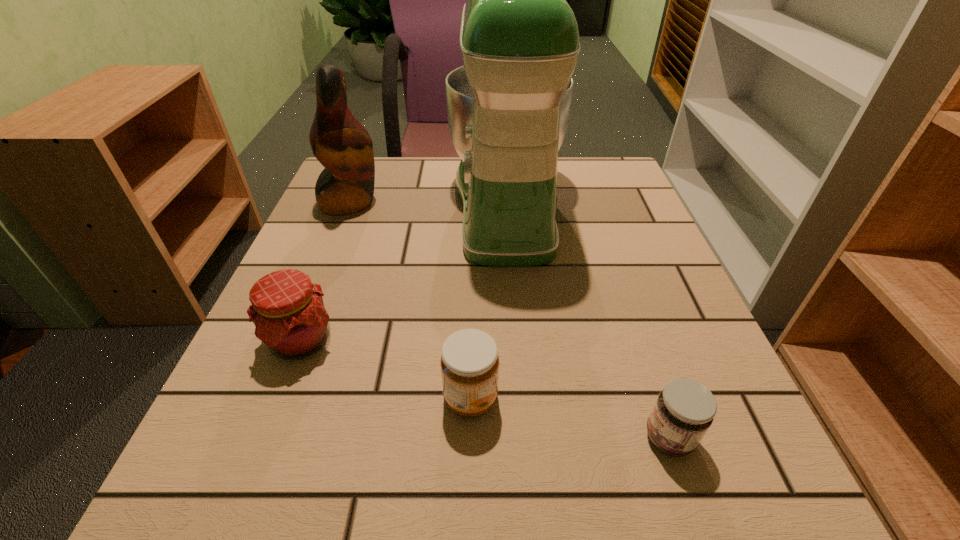
Identify the location of mixer. (508, 107).

The image size is (960, 540). I want to click on parrot, so click(339, 141).

The image size is (960, 540). In order to click on the third farthest object in this screenshot , I will do `click(288, 311)`.

You are a GUI agent. You are given a task and a screenshot of the screen. Output one action in this format:
    pyautogui.click(x=<x>, y=<y>)
    Task: Click on the leftmost jam
    
    Given the screenshot: What is the action you would take?
    pyautogui.click(x=288, y=311)

Identify the location of the second jam from right to left. (469, 362).

You are a GUI agent. You are given a task and a screenshot of the screen. Output one action in this format:
    pyautogui.click(x=<x>, y=<y>)
    Task: Click on the shortest jam
    The image size is (960, 540).
    Given the screenshot: What is the action you would take?
    pos(685,409)

Where is `the rightmost object`? The image size is (960, 540). the rightmost object is located at coordinates (685, 409).

At what (x,y) coordinates should I click in order to perform the action: click on blank space located 0.170m on the controls of the tallest object. Please return your answer as a coordinate pair (x, y). The width and height of the screenshot is (960, 540). Looking at the image, I should click on (375, 205).

The image size is (960, 540). Find the location of `vacant region located on the controls of the tallest object`. vacant region located on the controls of the tallest object is located at coordinates (396, 205).

This screenshot has width=960, height=540. Find the location of `vacant area located on the controls of the tallest object`. vacant area located on the controls of the tallest object is located at coordinates (357, 205).